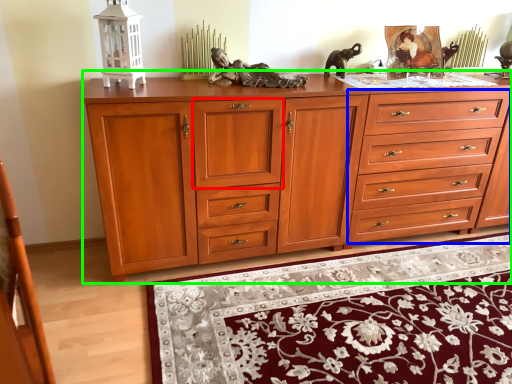
Question: Based on their relative distances, which object is nearer to drawer (highlighted by a red box)? Choose from drawer (highlighted by a blue box) and chest of drawers (highlighted by a green box).

Choices:
 (A) drawer
 (B) chest of drawers

Answer: (B)